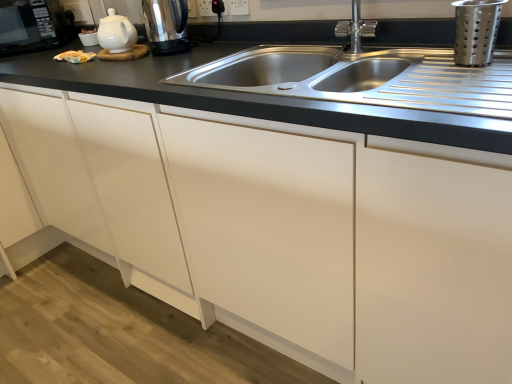
The height and width of the screenshot is (384, 512). Identify the location of free location to the left of polished stainless steel kettle at upper left. (131, 64).